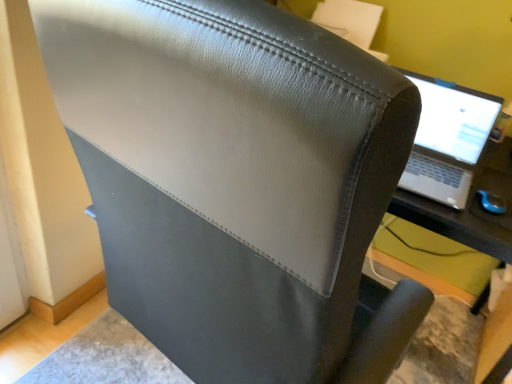
In order to click on silver metallic laptop at right in this screenshot , I will do `click(448, 140)`.

This screenshot has height=384, width=512. Describe the element at coordinates (448, 140) in the screenshot. I see `silver metallic laptop at right` at that location.

Locate an element on the screen. Image resolution: width=512 pixels, height=384 pixels. silver metallic laptop at right is located at coordinates (448, 140).